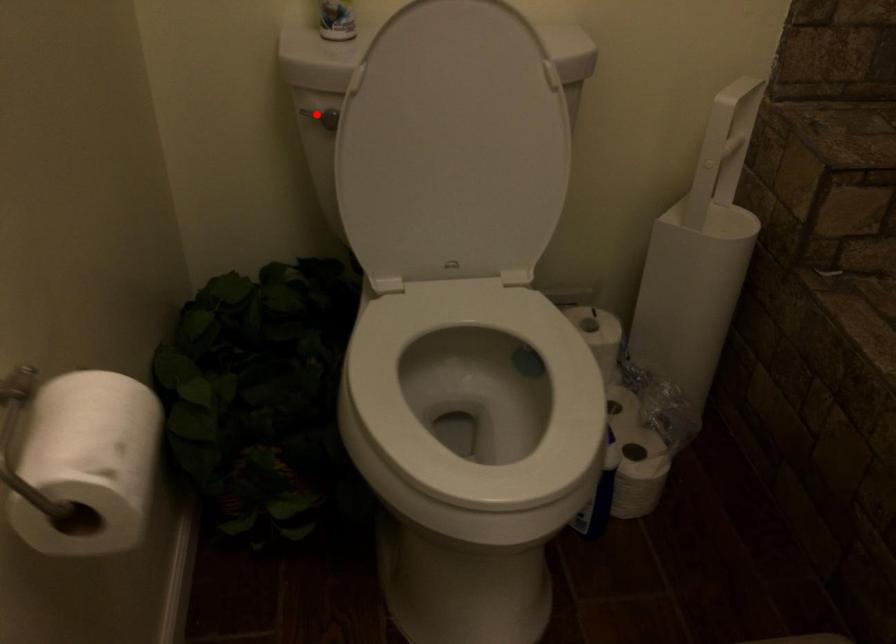
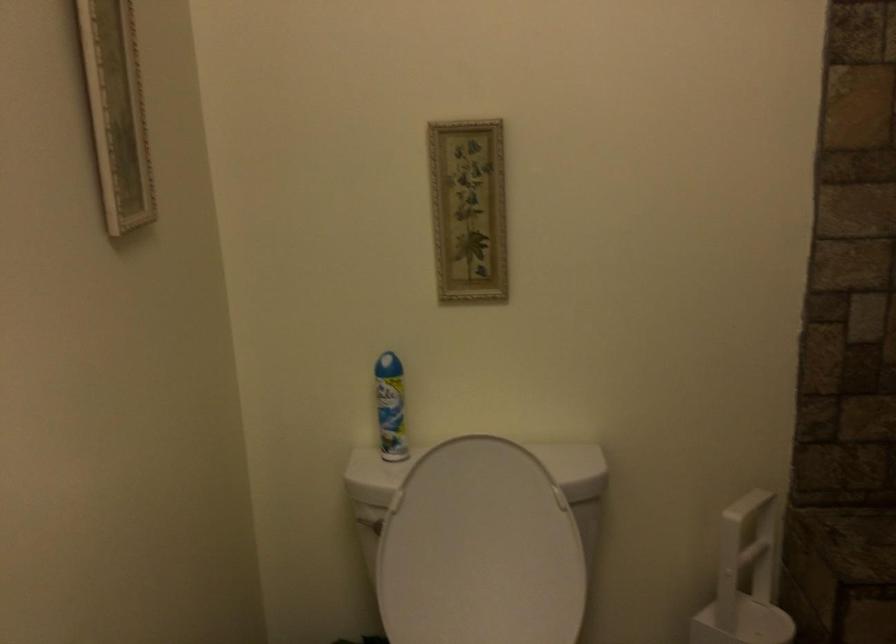
Question: A red point is marked in image1. In image2, is the corresponding 3D point closer to the camera or farther? Reply with the corresponding letter.

Choices:
 (A) The corresponding 3D point is closer.
 (B) The corresponding 3D point is farther.

Answer: (B)